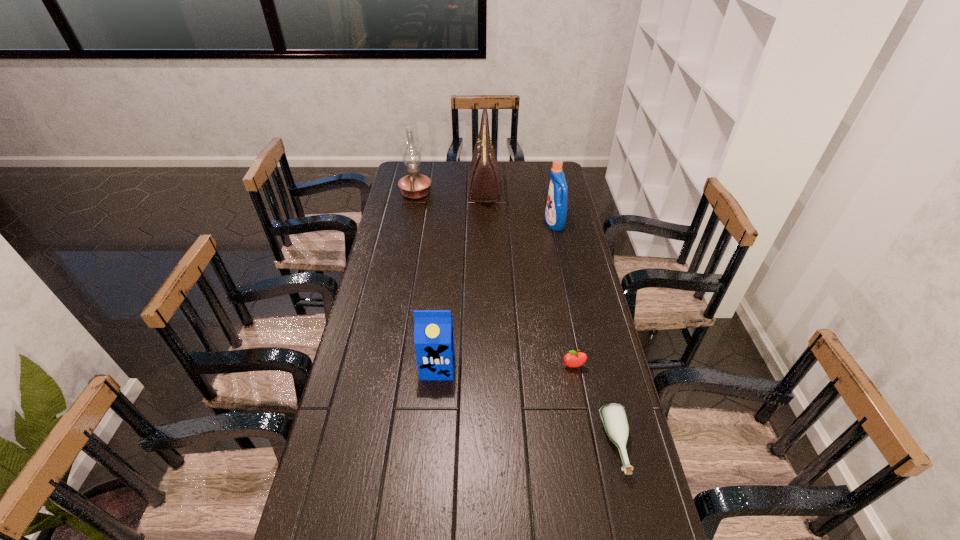
The image size is (960, 540). Identify the location of object at the left edge. click(413, 186).

Where is `detergent located in the right edge section of the desktop`? The image size is (960, 540). detergent located in the right edge section of the desktop is located at coordinates (555, 215).

What are the coordinates of `apple located in the right edge section of the desktop` in the screenshot? It's located at (573, 359).

The width and height of the screenshot is (960, 540). Identify the location of bottle that is at the right edge. (613, 415).

The width and height of the screenshot is (960, 540). I want to click on object that is at the far left corner, so click(413, 186).

Find the location of `free space at the far edge of the desktop`. free space at the far edge of the desktop is located at coordinates (461, 176).

Image resolution: width=960 pixels, height=540 pixels. In order to click on free space at the left edge of the desktop in this screenshot , I will do `click(354, 468)`.

You are a GUI agent. You are given a task and a screenshot of the screen. Output one action in this format:
    pyautogui.click(x=<x>, y=<y>)
    Task: Click on the vacant space at the right edge of the desktop
    This screenshot has height=540, width=960.
    Given the screenshot: What is the action you would take?
    [x=568, y=224]

I want to click on free space at the far right corner, so click(x=530, y=168).

In order to click on vacant space in between the second shortest object and the fifth object from right to left in this screenshot , I will do `click(506, 366)`.